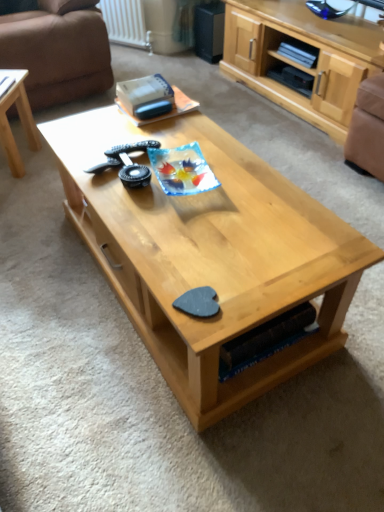
This screenshot has width=384, height=512. I want to click on free space in front of light wood/texture coffee table at left, which is the second coffee table from right to left, so click(25, 193).